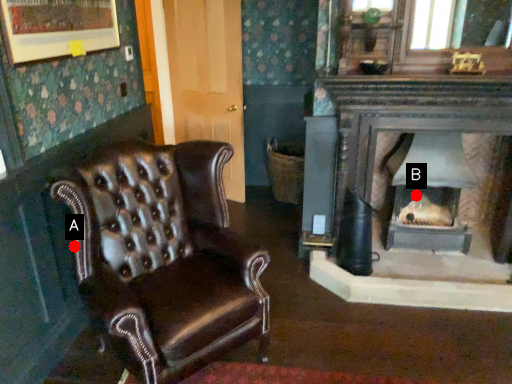
Question: Two points are circled on the image, labeled by A and B beside each circle. Which point appears farthest from the camera in this image?

Choices:
 (A) A is further
 (B) B is further

Answer: (B)